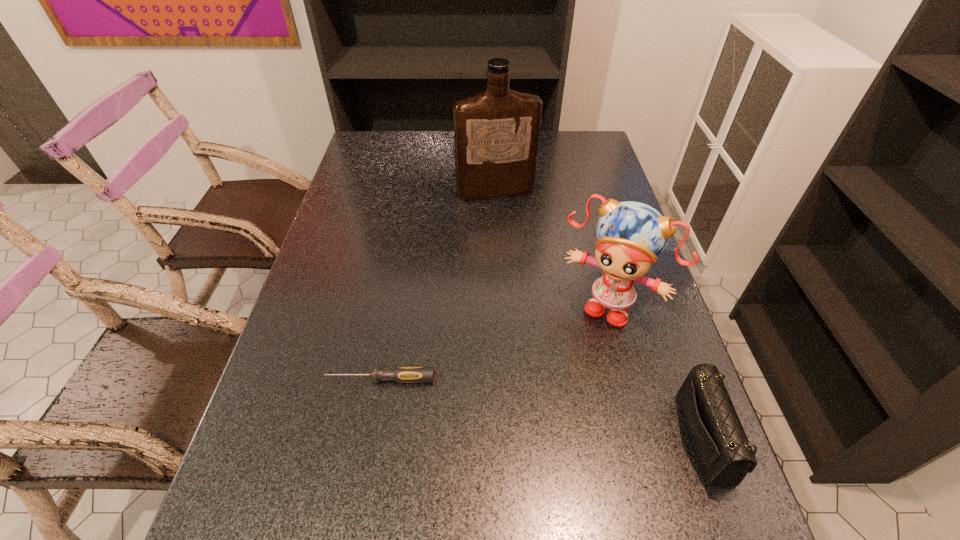
The width and height of the screenshot is (960, 540). What are the coordinates of `free space located on the label side of the tallest object` in the screenshot? It's located at (530, 276).

Locate an element on the screen. The height and width of the screenshot is (540, 960). vacant space located on the label side of the tallest object is located at coordinates (507, 212).

This screenshot has width=960, height=540. I want to click on vacant space located on the face of the third nearest object, so click(580, 348).

Locate an element on the screen. vacant space situated on the face of the third nearest object is located at coordinates (570, 367).

Locate an element on the screen. Image resolution: width=960 pixels, height=540 pixels. free space located on the face of the third nearest object is located at coordinates (555, 395).

This screenshot has height=540, width=960. I want to click on object located in the near edge section of the desktop, so click(724, 453).

The image size is (960, 540). I want to click on object that is at the left edge, so click(402, 374).

Locate an element on the screen. The height and width of the screenshot is (540, 960). clutch bag that is at the right edge is located at coordinates (724, 453).

This screenshot has width=960, height=540. I want to click on doll that is at the right edge, so click(631, 235).

I want to click on object situated at the near right corner, so click(724, 453).